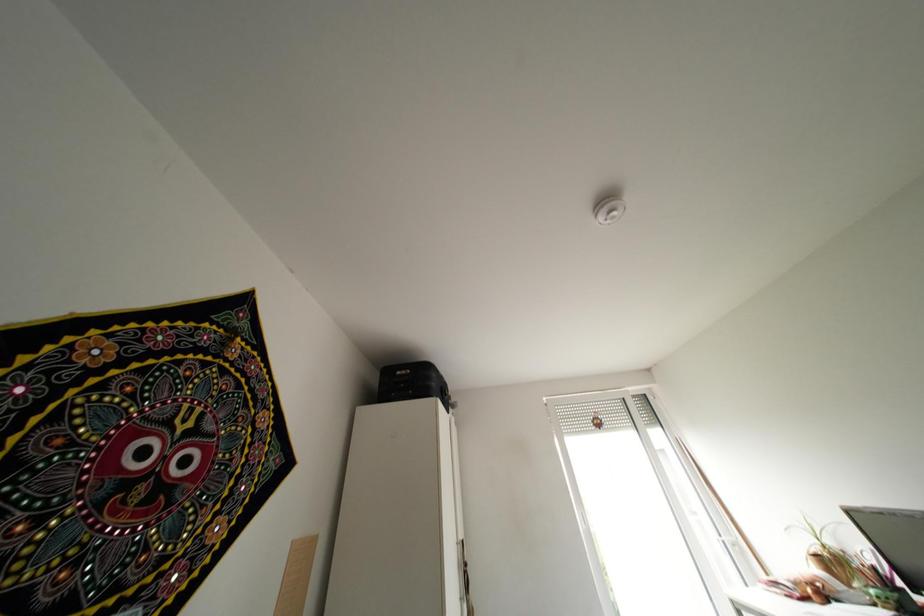
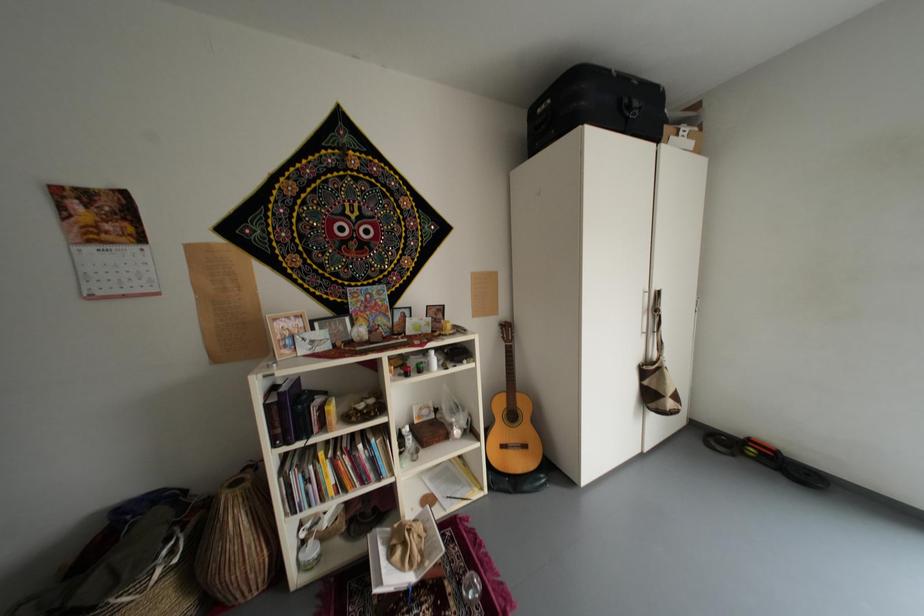
The first image is from the beginning of the video and the second image is from the end. How did the camera likely rotate when shooting the video?

The rotation direction of the camera is left-down.